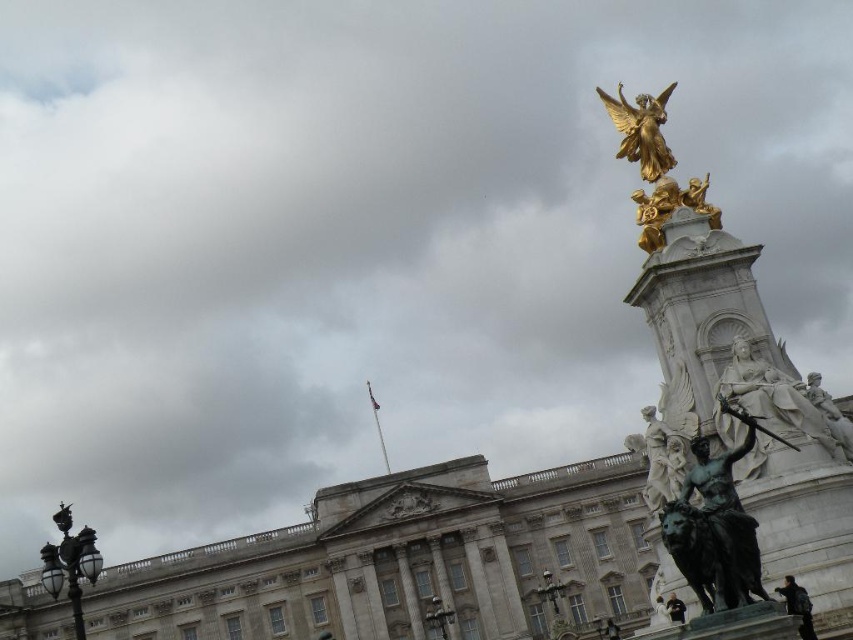
Between bronze statue at right and gold polished statue at upper right, which one appears on the left side from the viewer's perspective?

Positioned to the left is bronze statue at right.

Can you confirm if bronze statue at right is thinner than gold polished statue at upper right?

No, bronze statue at right is not thinner than gold polished statue at upper right.

What do you see at coordinates (715, 528) in the screenshot?
I see `bronze statue at right` at bounding box center [715, 528].

Where is `bronze statue at right`? The height and width of the screenshot is (640, 853). bronze statue at right is located at coordinates (715, 528).

From the picture: Is white marble statue at right smaller than gold polished statue at upper right?

Indeed, white marble statue at right has a smaller size compared to gold polished statue at upper right.

Does white marble statue at right have a lesser height compared to gold polished statue at upper right?

Indeed, white marble statue at right has a lesser height compared to gold polished statue at upper right.

Who is more distant from viewer, (833, 433) or (625, 108)?

The point (625, 108) is more distant.

Image resolution: width=853 pixels, height=640 pixels. In order to click on white marble statue at right in this screenshot , I will do `click(780, 401)`.

Which is in front, point (729, 506) or point (776, 410)?

Positioned in front is point (729, 506).

In the scene shown: Which of these two, bronze statue at right or white marble statue at right, stands taller?

Standing taller between the two is bronze statue at right.

Does point (706, 540) come in front of point (810, 404)?

Yes, point (706, 540) is in front of point (810, 404).

The width and height of the screenshot is (853, 640). I want to click on bronze statue at right, so click(x=715, y=528).